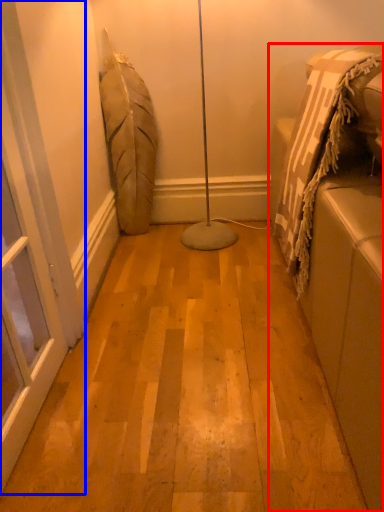
Question: Which object is closer to the camera taking this photo, furniture (highlighted by a red box) or screen door (highlighted by a blue box)?

Choices:
 (A) furniture
 (B) screen door

Answer: (A)